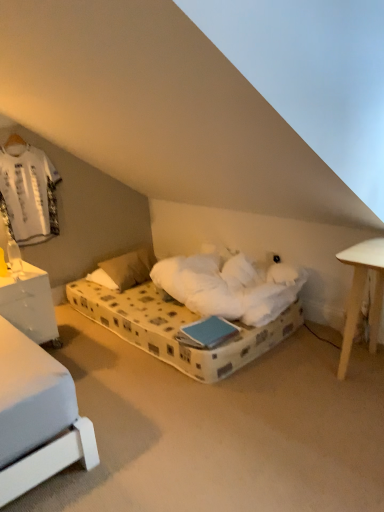
Question: Considering the relative sizes of white plastic table lamp at left and white glossy nightstand at left in the image provided, is white plastic table lamp at left thinner than white glossy nightstand at left?

Choices:
 (A) no
 (B) yes

Answer: (B)

Question: Can you confirm if white plastic table lamp at left is taller than white glossy nightstand at left?

Choices:
 (A) no
 (B) yes

Answer: (A)

Question: Can you confirm if white plastic table lamp at left is shorter than white glossy nightstand at left?

Choices:
 (A) yes
 (B) no

Answer: (A)

Question: Is white plastic table lamp at left turned away from white glossy nightstand at left?

Choices:
 (A) yes
 (B) no

Answer: (B)

Question: Does white plastic table lamp at left appear on the left side of white glossy nightstand at left?

Choices:
 (A) no
 (B) yes

Answer: (A)

Question: Is white glossy nightstand at left inside the boundaries of white plastic table lamp at left, or outside?

Choices:
 (A) inside
 (B) outside

Answer: (B)

Question: Would you say white glossy nightstand at left is to the left or to the right of white plastic table lamp at left in the picture?

Choices:
 (A) left
 (B) right

Answer: (A)

Question: From the image's perspective, is white glossy nightstand at left positioned above or below white plastic table lamp at left?

Choices:
 (A) below
 (B) above

Answer: (A)

Question: In terms of size, does white glossy nightstand at left appear bigger or smaller than white plastic table lamp at left?

Choices:
 (A) small
 (B) big

Answer: (B)

Question: Is white soft pillow at center wider or thinner than white plastic table lamp at left?

Choices:
 (A) thin
 (B) wide

Answer: (B)

Question: Is point (120, 264) closer or farther from the camera than point (21, 263)?

Choices:
 (A) closer
 (B) farther

Answer: (B)

Question: In terms of size, does white soft pillow at center appear bigger or smaller than white plastic table lamp at left?

Choices:
 (A) big
 (B) small

Answer: (A)

Question: Is white soft pillow at center in front of or behind white plastic table lamp at left in the image?

Choices:
 (A) front
 (B) behind

Answer: (B)

Question: In terms of size, does white plastic table lamp at left appear bigger or smaller than white glossy nightstand at left?

Choices:
 (A) small
 (B) big

Answer: (A)

Question: Is point (9, 264) positioned closer to the camera than point (31, 334)?

Choices:
 (A) farther
 (B) closer

Answer: (A)